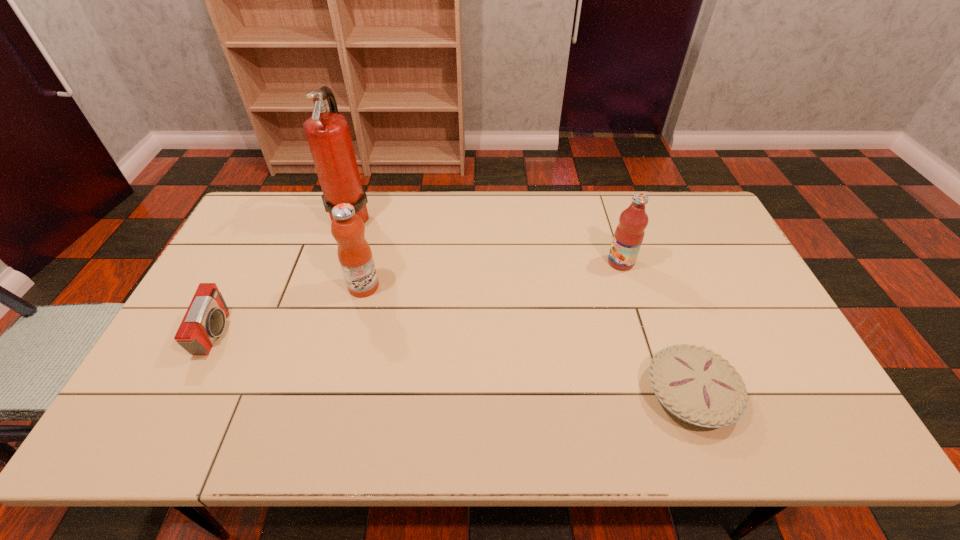
At what (x,y) coordinates should I click in order to perform the action: click on the tallest object. Please return your answer as a coordinate pair (x, y). Looking at the image, I should click on (328, 135).

What are the coordinates of `fire extinguisher` in the screenshot? It's located at (328, 135).

The image size is (960, 540). In order to click on the left fruit juice in this screenshot , I will do (355, 256).

Image resolution: width=960 pixels, height=540 pixels. Find the location of `the third nearest object`. the third nearest object is located at coordinates (355, 256).

Find the location of a particular element. The image size is (960, 540). the farther fruit juice is located at coordinates (629, 234).

Locate an element on the screen. The height and width of the screenshot is (540, 960). the second farthest object is located at coordinates (629, 234).

Locate an element on the screen. This screenshot has width=960, height=540. the fourth tallest object is located at coordinates (205, 319).

Where is `the leftmost object`? The image size is (960, 540). the leftmost object is located at coordinates point(205,319).

Where is `pie`? This screenshot has width=960, height=540. pie is located at coordinates (696, 385).

Find the location of a particular element. Image resolution: width=960 pixels, height=540 pixels. vacant space located 0.170m at the nozzle of the farthest object is located at coordinates (421, 216).